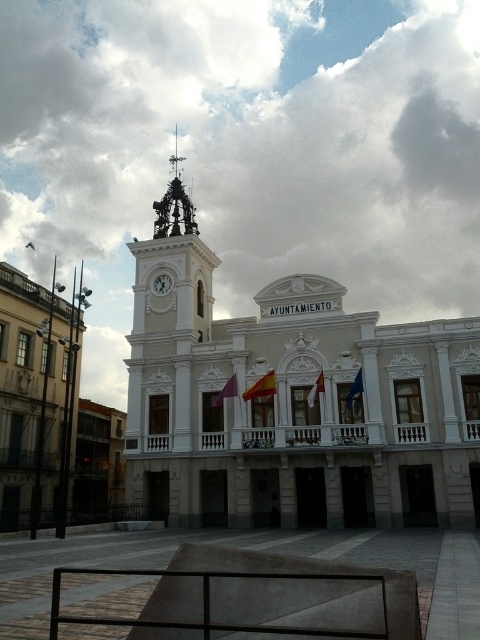
Question: Which object appears farthest from the camera in this image?

Choices:
 (A) red fabric flag at center
 (B) white stone building at center
 (C) dark gray metal rail at lower center

Answer: (A)

Question: Can you confirm if dark gray metal rail at lower center is smaller than white glossy clock at upper left?

Choices:
 (A) yes
 (B) no

Answer: (B)

Question: Does red fabric flag at center appear over white glossy clock at upper left?

Choices:
 (A) yes
 (B) no

Answer: (B)

Question: Which point is closer to the camera taking this photo?

Choices:
 (A) (282, 365)
 (B) (265, 376)
 (C) (168, 285)
 (D) (265, 576)

Answer: (D)

Question: Does white stone building at center appear over dark gray metal rail at lower center?

Choices:
 (A) no
 (B) yes

Answer: (B)

Question: Estimate the real-world distances between objects in this image. Which object is closer to the red fabric flag at center?

Choices:
 (A) white stone building at center
 (B) white glossy clock at upper left

Answer: (A)